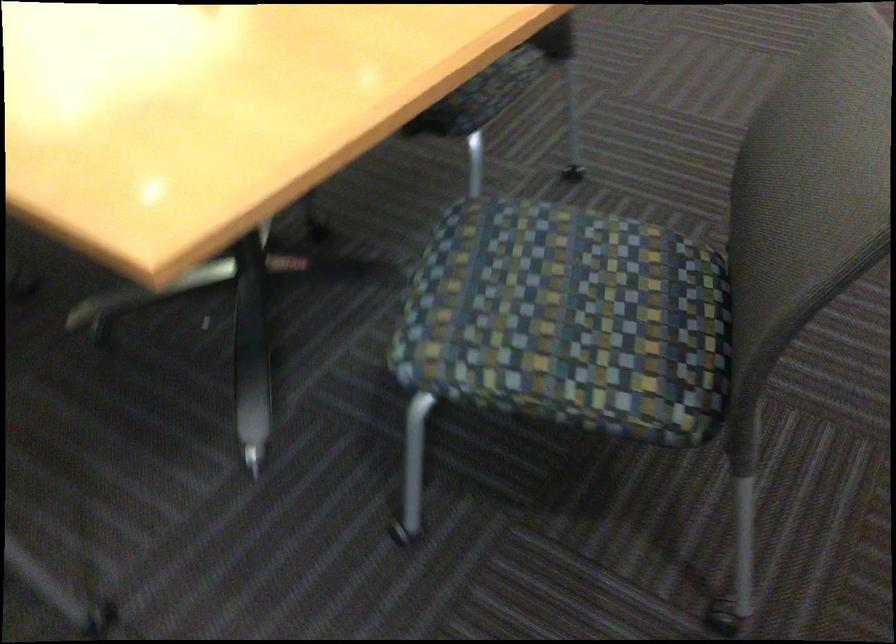
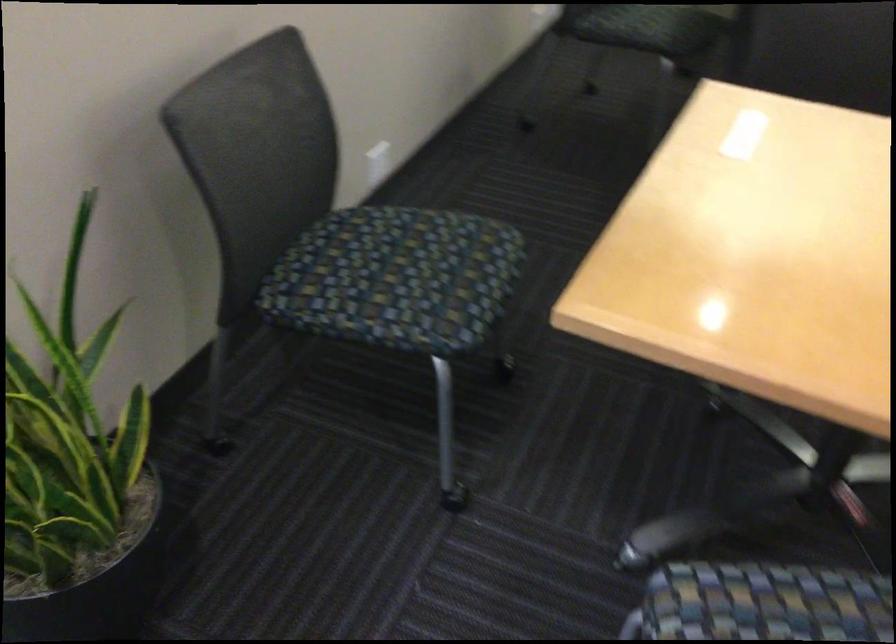
First-person continuous shooting, in which direction is the camera rotating?

The rotation direction of the camera is left-down.